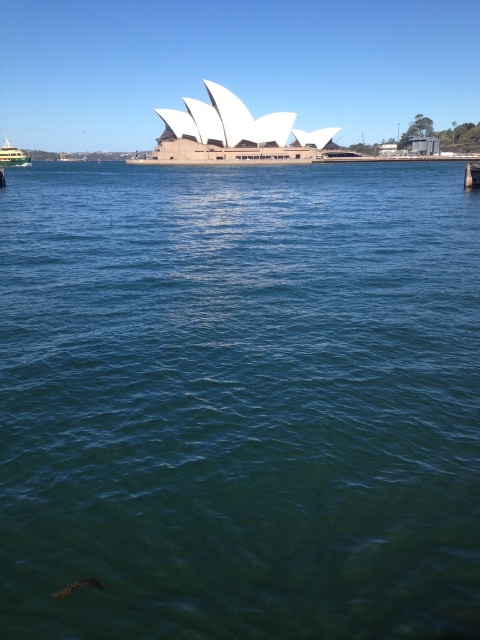
Question: Which object appears closest to the camera in this image?

Choices:
 (A) green water at center
 (B) green metallic ferry at left

Answer: (A)

Question: Does green water at center have a greater width compared to green metallic ferry at left?

Choices:
 (A) yes
 (B) no

Answer: (B)

Question: Which of the following is the farthest from the observer?

Choices:
 (A) green water at center
 (B) green metallic ferry at left

Answer: (B)

Question: From the image, what is the correct spatial relationship of green water at center in relation to green metallic ferry at left?

Choices:
 (A) above
 (B) below

Answer: (B)

Question: Is green water at center further to camera compared to green metallic ferry at left?

Choices:
 (A) yes
 (B) no

Answer: (B)